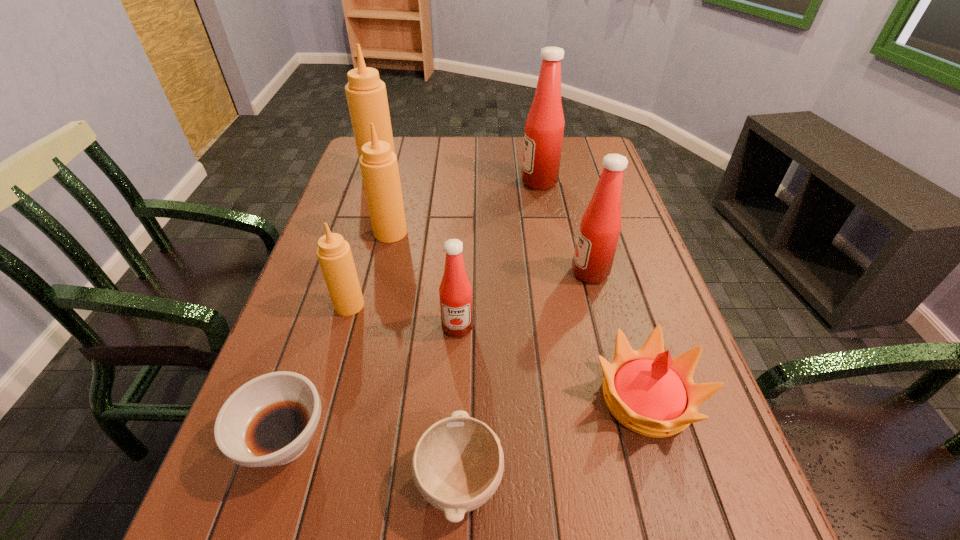
Where is `object situated at the far left corner`? object situated at the far left corner is located at coordinates (366, 94).

Find the location of a particular element. The image size is (960, 540). free space at the far edge is located at coordinates (492, 141).

Identify the location of vacant space at the near edge of the desktop. This screenshot has width=960, height=540. (364, 537).

At what (x,y) coordinates should I click in order to perform the action: click on vacant area at the left edge. Please return your answer as a coordinate pair (x, y). This screenshot has height=540, width=960. Looking at the image, I should click on click(342, 230).

Locate an element on the screen. This screenshot has width=960, height=540. free space at the right edge of the desktop is located at coordinates (x=653, y=286).

The image size is (960, 540). I want to click on free region at the far left corner of the desktop, so click(350, 171).

At what (x,y) coordinates should I click in order to perform the action: click on vacant area that lies between the second biggest red condiment and the beige bowl. Please return your answer as a coordinate pair (x, y). Looking at the image, I should click on (525, 376).

The width and height of the screenshot is (960, 540). Identify the location of empty location between the biggest red condiment and the soup bowl. (412, 311).

This screenshot has height=540, width=960. I want to click on free space between the farthest tan condiment and the nearest tan condiment, so click(x=365, y=240).

Locate an element on the screen. The width and height of the screenshot is (960, 540). unoccupied position between the soup bowl and the nearest red condiment is located at coordinates (372, 384).